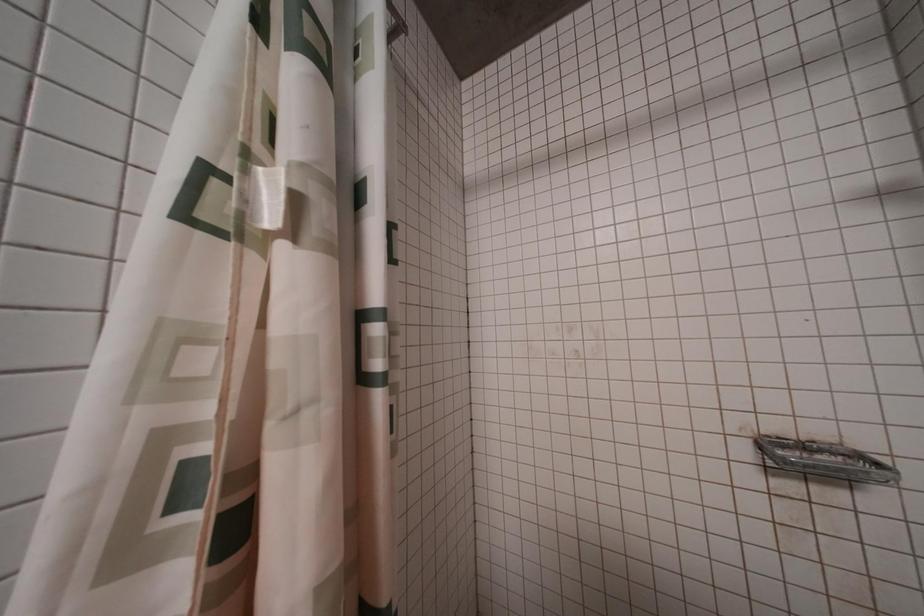
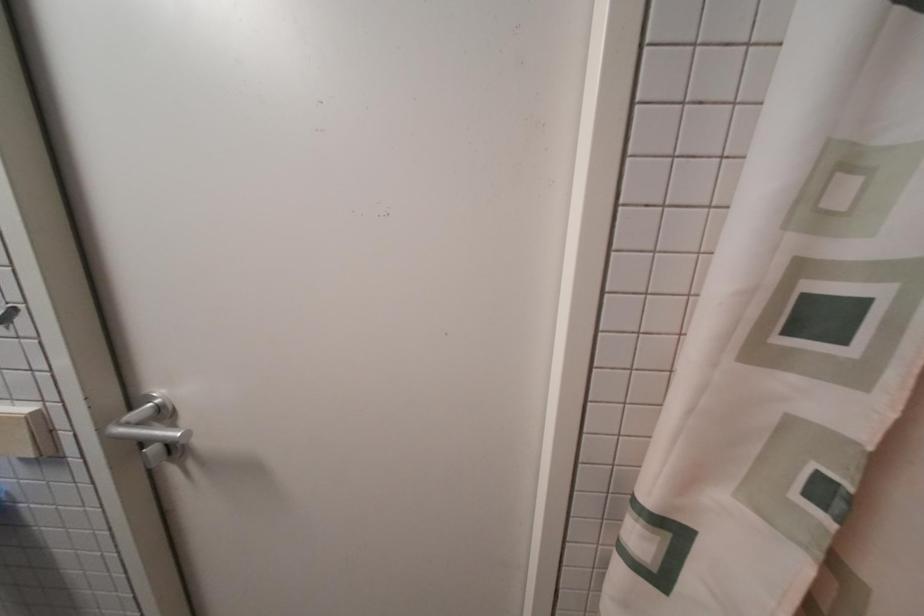
The first image is from the beginning of the video and the second image is from the end. How did the camera likely rotate when shooting the video?

The camera rotated toward left-down.